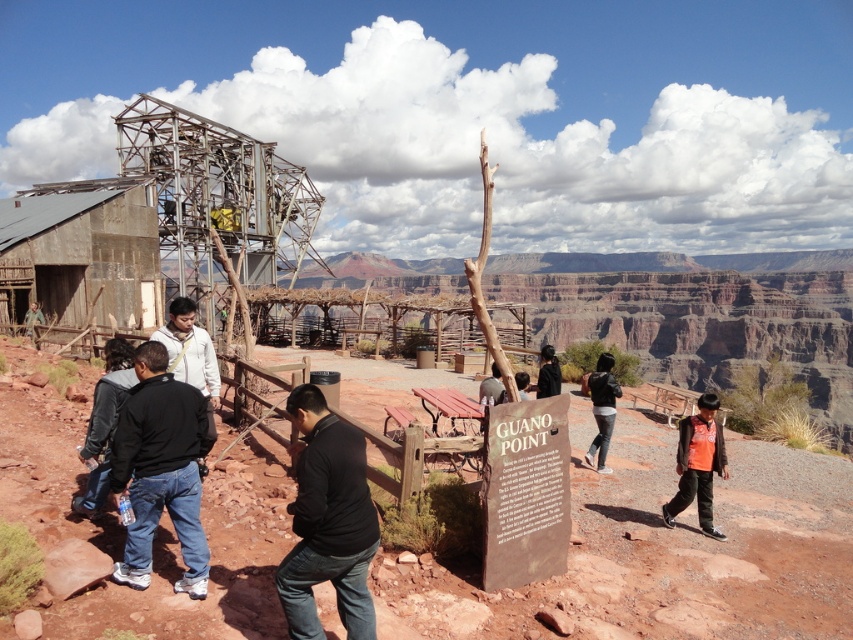
Does black matte jacket at center appear under white matte jacket at center?

Indeed, black matte jacket at center is positioned under white matte jacket at center.

Which of these two, black matte jacket at center or white matte jacket at center, stands shorter?

With less height is white matte jacket at center.

Image resolution: width=853 pixels, height=640 pixels. Describe the element at coordinates (328, 520) in the screenshot. I see `black matte jacket at center` at that location.

At what (x,y) coordinates should I click in order to perform the action: click on black matte jacket at center. Please return your answer as a coordinate pair (x, y). Looking at the image, I should click on (328, 520).

Does orange fabric jacket at right come behind dark gray jacket at lower left?

Yes, it is behind dark gray jacket at lower left.

Between orange fabric jacket at right and dark gray jacket at lower left, which one is positioned lower?

orange fabric jacket at right

This screenshot has width=853, height=640. I want to click on orange fabric jacket at right, so click(698, 465).

Between point (300, 440) and point (41, 316), which one is positioned in front?

Point (300, 440) is in front.

Between black matte jacket at center and matte black jacket at lower left, which one is positioned higher?

matte black jacket at lower left

Who is more distant from viewer, [321,566] or [42,316]?

The point [42,316] is behind.

Locate an element on the screen. black matte jacket at center is located at coordinates (328, 520).